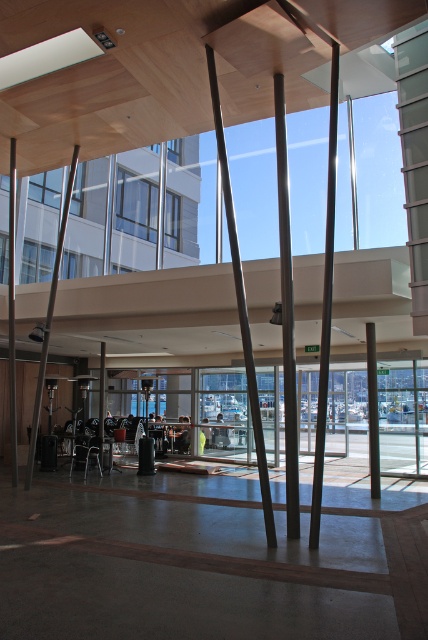
Question: Is polished metal pole at center wider than smooth gray pole at center?

Choices:
 (A) yes
 (B) no

Answer: (B)

Question: Among these objects, which one is farthest from the camera?

Choices:
 (A) smooth gray pole at center
 (B) polished metal pole at center

Answer: (A)

Question: From the image, what is the correct spatial relationship of polished metal pole at center in relation to smooth gray pole at center?

Choices:
 (A) left
 (B) right

Answer: (A)

Question: Which point is farther to the camera?

Choices:
 (A) smooth gray pole at center
 (B) polished metal pole at center

Answer: (A)

Question: Does polished metal pole at center come behind smooth gray pole at center?

Choices:
 (A) yes
 (B) no

Answer: (B)